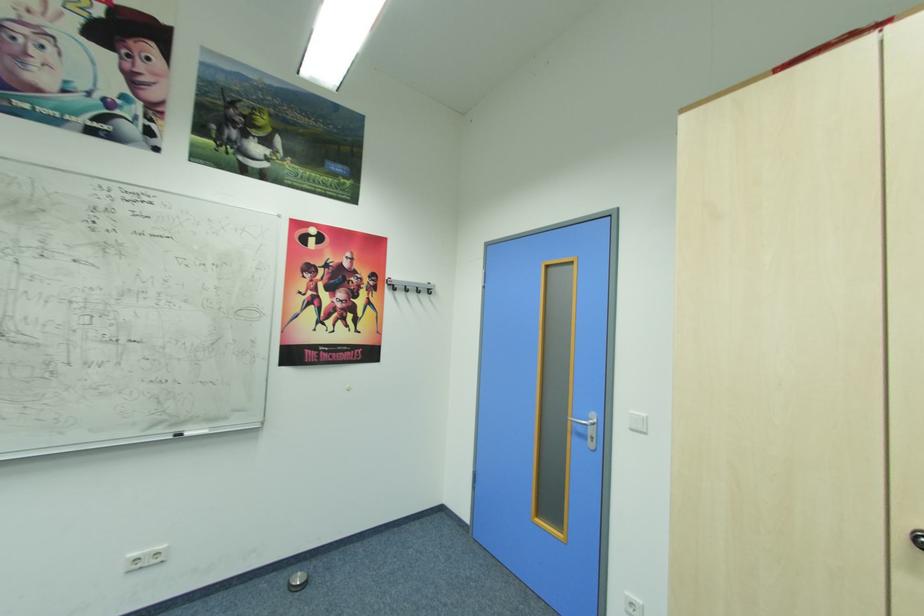
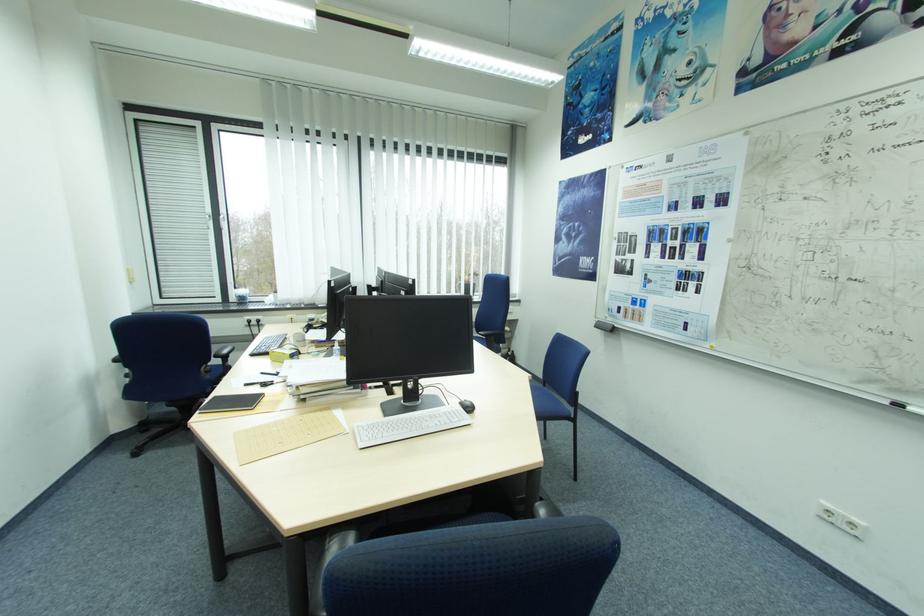
Question: The first image is from the beginning of the video and the second image is from the end. How did the camera likely rotate when shooting the video?

Choices:
 (A) Left
 (B) Right
 (C) Up
 (D) Down

Answer: (A)